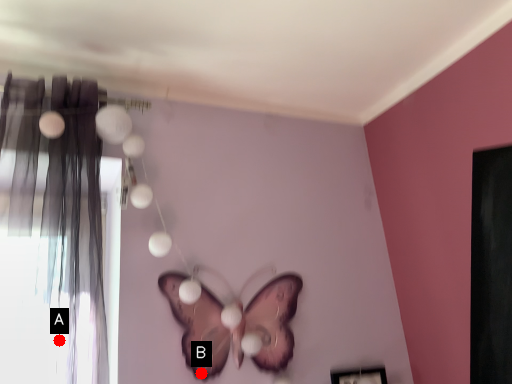
Question: Two points are circled on the image, labeled by A and B beside each circle. Which point is farther from the camera taking this photo?

Choices:
 (A) A is further
 (B) B is further

Answer: (B)